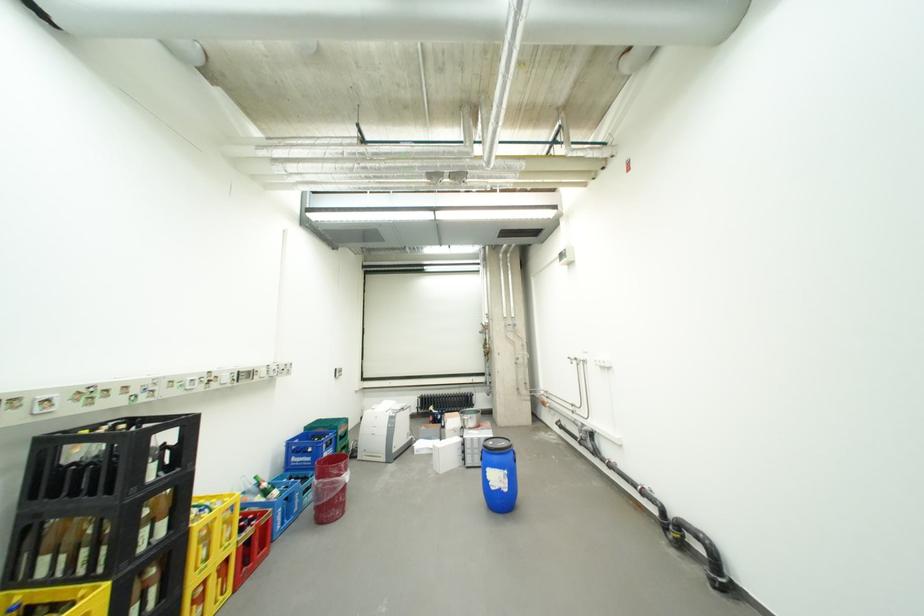
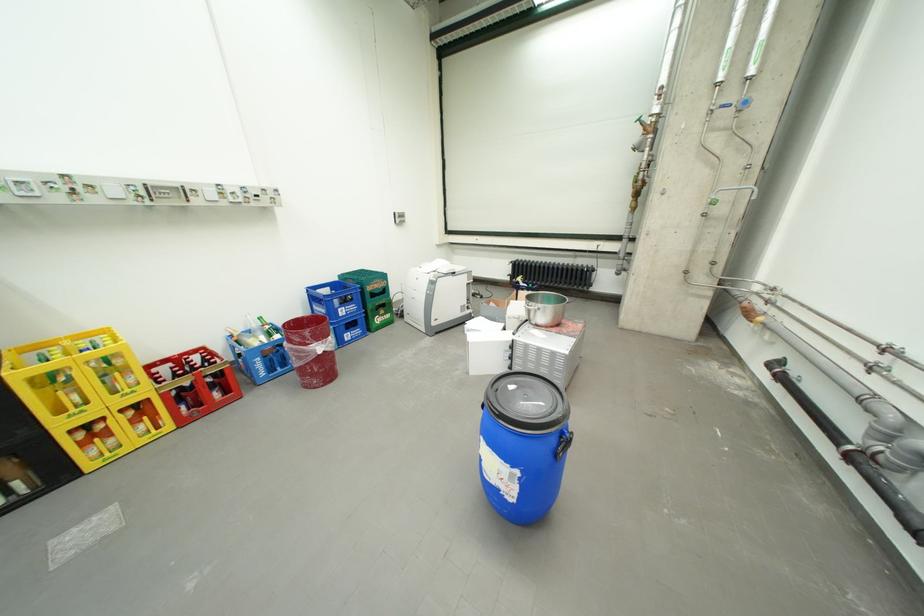
Find the pixel in the second image that matches point (248, 551) in the first image.

(172, 397)